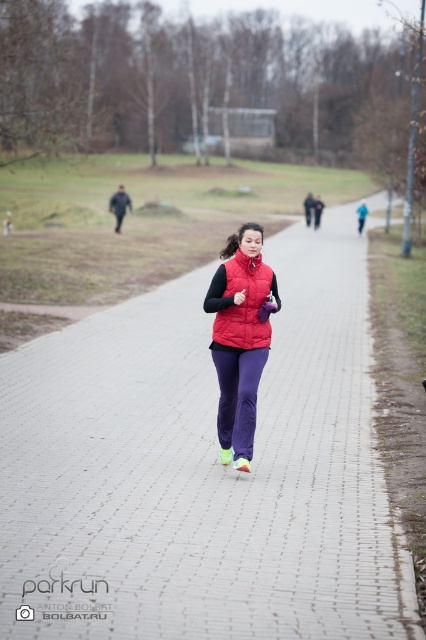
Question: Which is nearer to the brick paved path at center?

Choices:
 (A) red puffer vest at center
 (B) matte red vest at center

Answer: (A)

Question: Which point appears closest to the camera in this image?

Choices:
 (A) (256, 364)
 (B) (227, 339)

Answer: (A)

Question: Can you confirm if brick paved path at center is positioned above red puffer vest at center?

Choices:
 (A) yes
 (B) no

Answer: (B)

Question: Can you confirm if brick paved path at center is positioned above matte red vest at center?

Choices:
 (A) yes
 (B) no

Answer: (B)

Question: Which of the following is the closest to the observer?

Choices:
 (A) (238, 371)
 (B) (267, 330)

Answer: (A)

Question: From the image, what is the correct spatial relationship of matte red vest at center in relation to red puffer vest at center?

Choices:
 (A) below
 (B) above

Answer: (A)